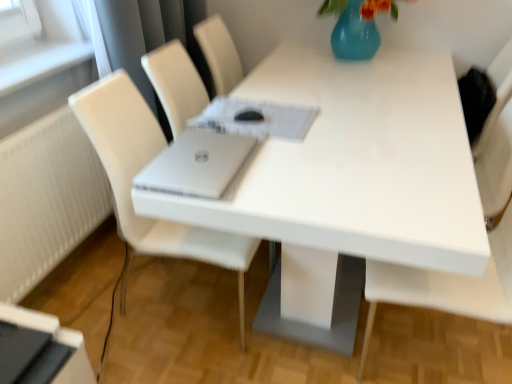
Question: Which is correct: silver metallic laptop at center is inside white matte chair at right, which appears as the 1th chair when viewed from the right, or outside of it?

Choices:
 (A) outside
 (B) inside

Answer: (A)

Question: From their relative heights in the image, would you say silver metallic laptop at center is taller or shorter than white matte chair at right, which appears as the 1th chair when viewed from the right?

Choices:
 (A) short
 (B) tall

Answer: (A)

Question: Estimate the real-world distances between objects in this image. Which object is closer to the white leather chair at center, the first chair in the left-to-right sequence?

Choices:
 (A) white glossy table at center
 (B) white matte chair at right, which ranks as the second chair in left-to-right order
 (C) silver metallic laptop at center
 (D) black glossy desktop at lower left

Answer: (C)

Question: Which of these objects is positioned closest to the white glossy table at center?

Choices:
 (A) white matte chair at right, which appears as the 1th chair when viewed from the right
 (B) silver metallic laptop at center
 (C) white leather chair at center, the first chair in the left-to-right sequence
 (D) black glossy desktop at lower left

Answer: (B)